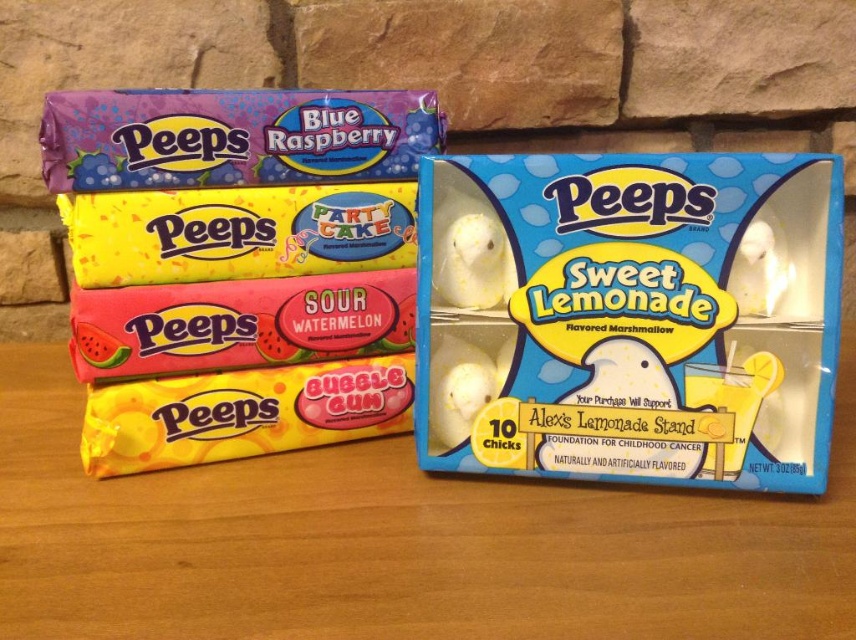
You are trying to reach the yellow glossy marshmallow at center from the wooden table at center. Can you grab it without moving the table?

The wooden table at center is much taller than the yellow glossy marshmallow at center, so you can easily reach and grab the yellow glossy marshmallow at center without needing to move the table.

You are a customer at a store and see the white marshmallow chicks at center and the matte plastic peeps at left. Which one is bigger?

The white marshmallow chicks at center is smaller than the matte plastic peeps at left, so the matte plastic peeps at left is bigger.

You are placing a new Peeps package on the wooden table at center. According to the image, where should you position it to avoid overlapping with existing items?

The wooden table at center is located at point (397,541), so you should position the new Peeps package in an area that does not overlap with the existing stacks and open box at that coordinate.